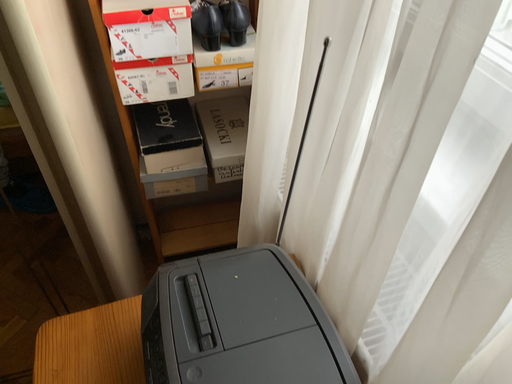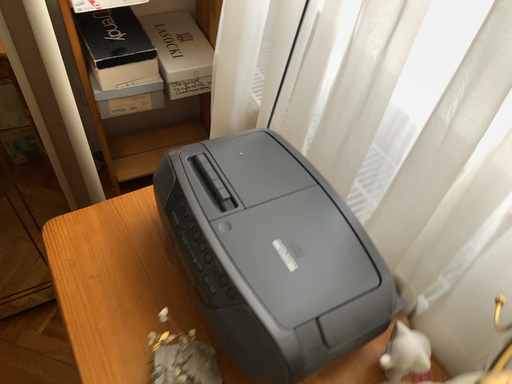
Question: How did the camera likely rotate when shooting the video?

Choices:
 (A) rotated downward
 (B) rotated upward

Answer: (A)